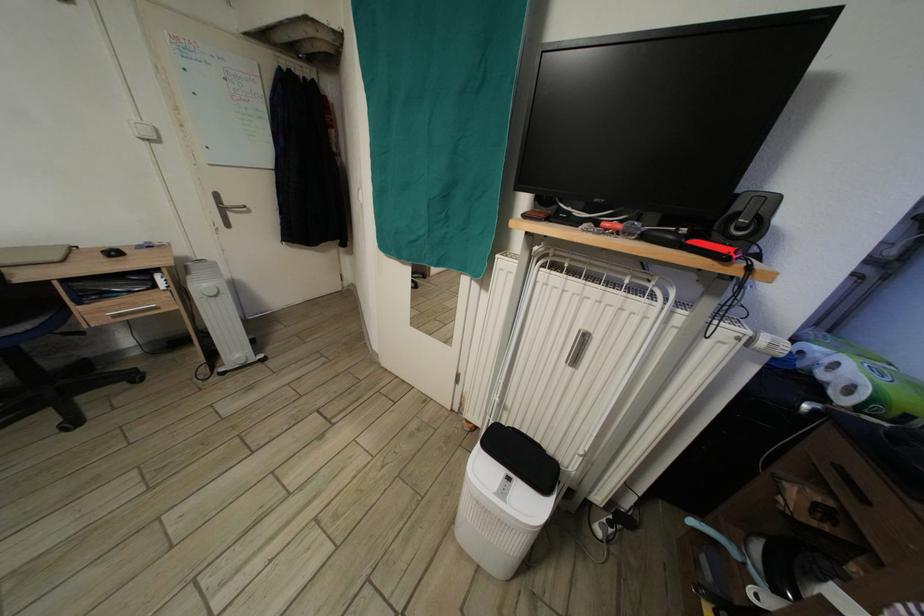
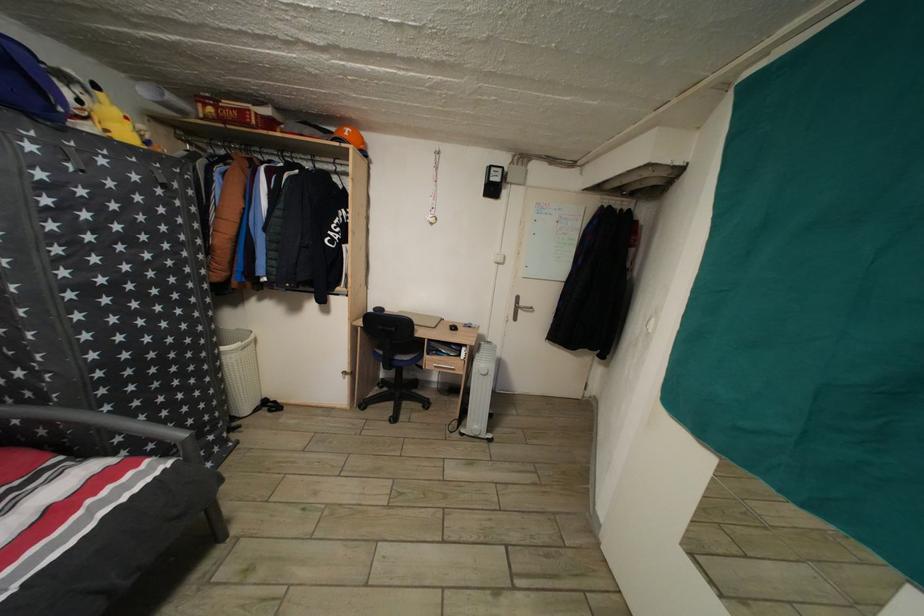
Question: The camera is either moving clockwise (left) or counter-clockwise (right) around the object. The first image is from the beginning of the video and the second image is from the end. Is the camera moving left or right when shooting the video?

Choices:
 (A) Left
 (B) Right

Answer: (B)